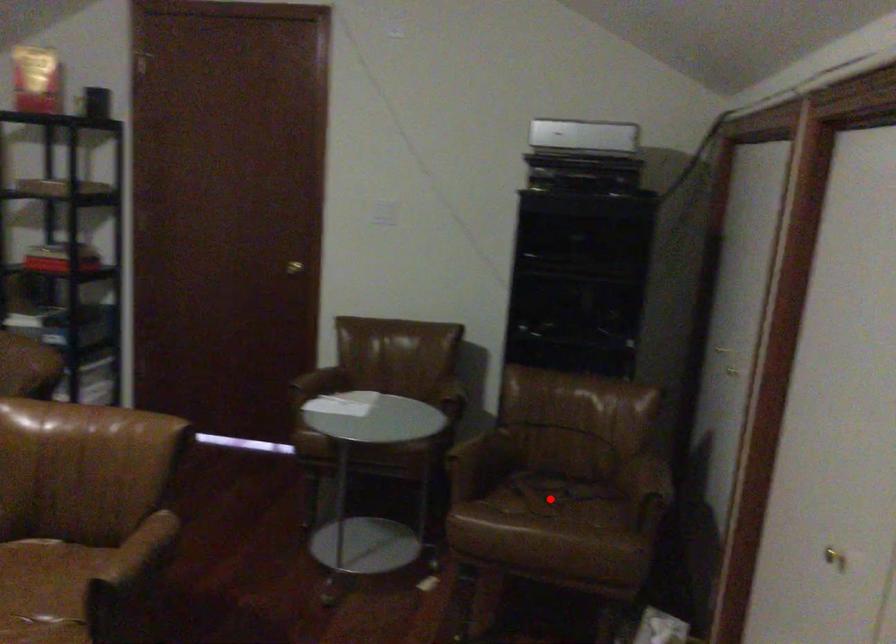
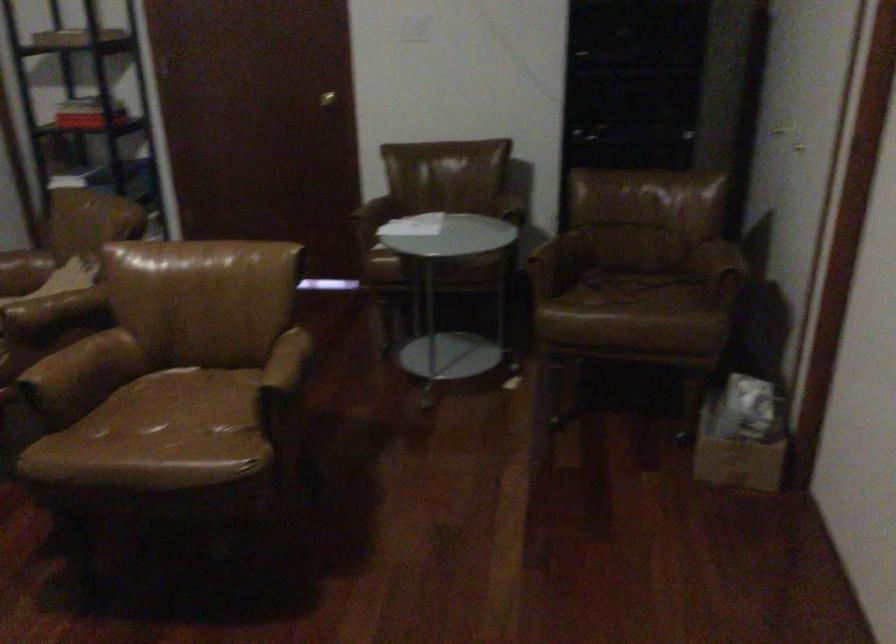
Question: I am providing you with two images of the same scene from different viewpoints. A red point is marked on the first image. Can you still see the location of the red point in image 2?

Choices:
 (A) Yes
 (B) No

Answer: (A)